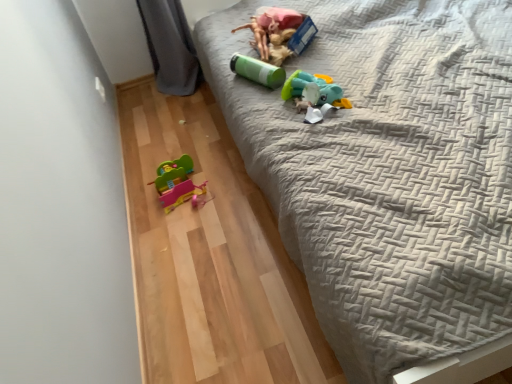
You are a GUI agent. You are given a task and a screenshot of the screen. Output one action in this format:
    pyautogui.click(x=<x>, y=<y>)
    Task: Click on the vacant point to the right of matte plastic toy car at lower left, which is counted as the 4th toy, starting from the top
    
    Given the screenshot: What is the action you would take?
    pyautogui.click(x=229, y=178)